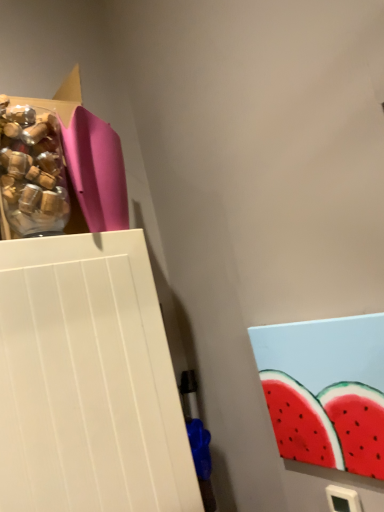
This screenshot has width=384, height=512. What do you see at coordinates (31, 172) in the screenshot? I see `translucent plastic bottle at upper left` at bounding box center [31, 172].

Identify the location of translucent plastic bottle at upper left. Image resolution: width=384 pixels, height=512 pixels. tap(31, 172).

What do you see at coordinates (88, 162) in the screenshot?
I see `pink matte paper at upper left` at bounding box center [88, 162].

Identify the location of pink matte paper at upper left. The width and height of the screenshot is (384, 512). tap(88, 162).

This screenshot has height=512, width=384. In order to click on translucent plastic bottle at upper left in this screenshot , I will do `click(31, 172)`.

Which is more to the right, pink matte paper at upper left or translucent plastic bottle at upper left?

pink matte paper at upper left.

Which object is closer to the camera taking this photo, pink matte paper at upper left or translucent plastic bottle at upper left?

translucent plastic bottle at upper left is in front.

Does point (72, 110) come in front of point (20, 118)?

No, (72, 110) is further to viewer.

From the image's perspective, who appears lower, pink matte paper at upper left or translucent plastic bottle at upper left?

translucent plastic bottle at upper left.

From a real-world perspective, between pink matte paper at upper left and translucent plastic bottle at upper left, who is vertically lower?

pink matte paper at upper left is physically lower.

Considering the relative sizes of pink matte paper at upper left and translucent plastic bottle at upper left in the image provided, is pink matte paper at upper left thinner than translucent plastic bottle at upper left?

No, pink matte paper at upper left is not thinner than translucent plastic bottle at upper left.

Does pink matte paper at upper left have a lesser height compared to translucent plastic bottle at upper left?

No, pink matte paper at upper left is not shorter than translucent plastic bottle at upper left.

Can you confirm if pink matte paper at upper left is smaller than translucent plastic bottle at upper left?

No.

Can translucent plastic bottle at upper left be found inside pink matte paper at upper left?

No.

Is pink matte paper at upper left positioned far away from translucent plastic bottle at upper left?

They are positioned close to each other.

Is pink matte paper at upper left positioned with its back to translucent plastic bottle at upper left?

pink matte paper at upper left is not turned away from translucent plastic bottle at upper left.

Can you tell me how much pink matte paper at upper left and translucent plastic bottle at upper left differ in facing direction?

0.00558 degrees separate the facing orientations of pink matte paper at upper left and translucent plastic bottle at upper left.

Measure the distance from pink matte paper at upper left to translucent plastic bottle at upper left.

pink matte paper at upper left and translucent plastic bottle at upper left are 3.50 inches apart from each other.

Image resolution: width=384 pixels, height=512 pixels. I want to click on food in front of the pink matte paper at upper left, so click(x=31, y=172).

Which object is positioned more to the left, translucent plastic bottle at upper left or pink matte paper at upper left?

From the viewer's perspective, translucent plastic bottle at upper left appears more on the left side.

Which is in front, translucent plastic bottle at upper left or pink matte paper at upper left?

Positioned in front is translucent plastic bottle at upper left.

Which point is more forward, (7, 146) or (88, 158)?

The point (7, 146) is more forward.

Consider the image. From the image's perspective, is translucent plastic bottle at upper left above or below pink matte paper at upper left?

translucent plastic bottle at upper left is situated lower than pink matte paper at upper left in the image.

From a real-world perspective, between translucent plastic bottle at upper left and pink matte paper at upper left, who is vertically lower?

pink matte paper at upper left, from a real-world perspective.

Between translucent plastic bottle at upper left and pink matte paper at upper left, which one has larger width?

pink matte paper at upper left.

Is translucent plastic bottle at upper left shorter than pink matte paper at upper left?

Indeed, translucent plastic bottle at upper left has a lesser height compared to pink matte paper at upper left.

Considering the relative sizes of translucent plastic bottle at upper left and pink matte paper at upper left in the image provided, is translucent plastic bottle at upper left smaller than pink matte paper at upper left?

Yes.

Do you think translucent plastic bottle at upper left is within pink matte paper at upper left, or outside of it?

translucent plastic bottle at upper left is not inside pink matte paper at upper left, it's outside.

Does translucent plastic bottle at upper left touch pink matte paper at upper left?

Yes, translucent plastic bottle at upper left and pink matte paper at upper left clearly make contact.

Is translucent plastic bottle at upper left turned away from pink matte paper at upper left?

translucent plastic bottle at upper left does not have its back to pink matte paper at upper left.

How many degrees apart are the facing directions of translucent plastic bottle at upper left and pink matte paper at upper left?

The angular difference between translucent plastic bottle at upper left and pink matte paper at upper left is 0.00558 degrees.

At what (x,y) coordinates should I click in order to perform the action: click on food in front of the pink matte paper at upper left. Please return your answer as a coordinate pair (x, y). Looking at the image, I should click on (31, 172).

Locate an element on the screen. The image size is (384, 512). food in front of the pink matte paper at upper left is located at coordinates (31, 172).

The image size is (384, 512). In order to click on food positioned vertically above the pink matte paper at upper left (from a real-world perspective) in this screenshot , I will do `click(31, 172)`.